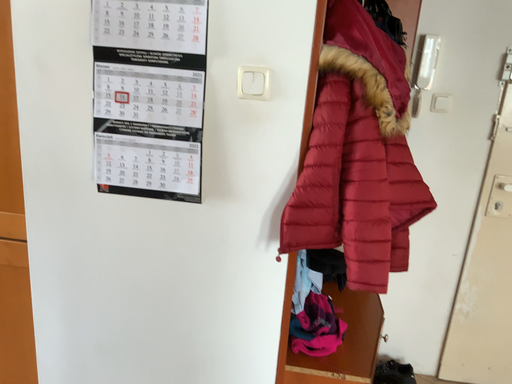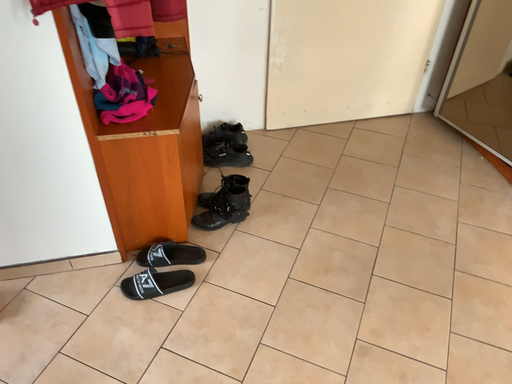
Question: How did the camera likely rotate when shooting the video?

Choices:
 (A) rotated downward
 (B) rotated upward

Answer: (A)